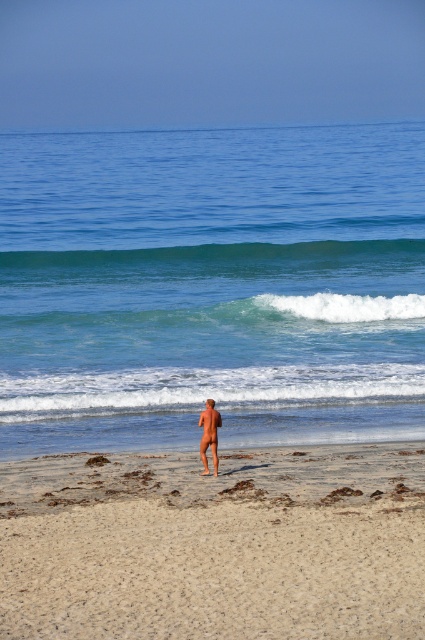
You are standing at the beach and notice the smooth sand at center and the smooth tan skin at center. Which object is nearer to you?

The smooth sand at center is closer to the viewer than the smooth tan skin at center.

You are standing on the beach and see two points marked in the image. The first point is at coordinates point (399, 368) and the second is at point (201, 419). Which point is closer to you?

Point (399, 368) is further to the viewer than point (201, 419), so the second point is closer to you.

You are standing on the beach and see the point marked at coordinates (215, 545). According to the image, what type of terrain is located at that point?

The point at (215, 545) indicates smooth sand at center.